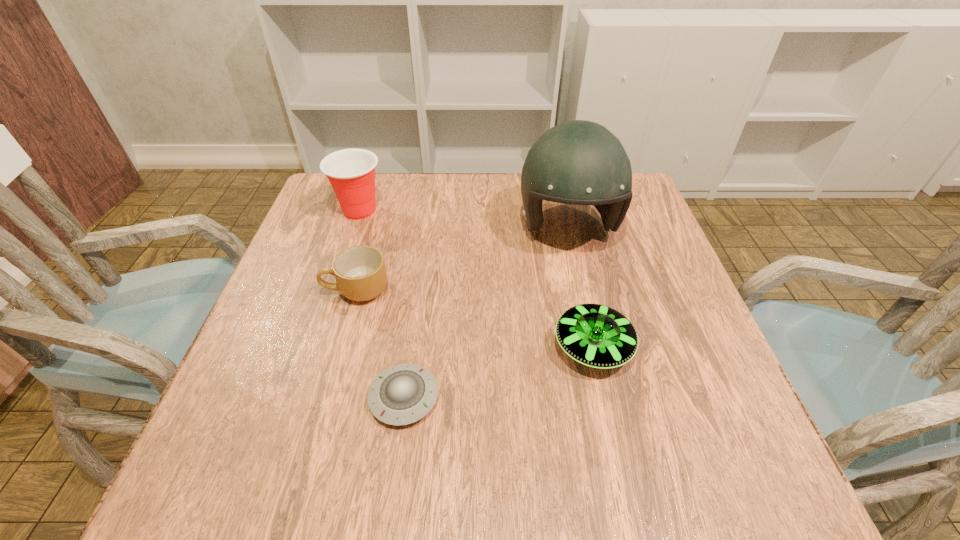
In the image, there is a desktop. At what (x,y) coordinates should I click in order to perform the action: click on vacant space at the near edge. Please return your answer as a coordinate pair (x, y). The width and height of the screenshot is (960, 540). Looking at the image, I should click on (597, 470).

I want to click on free point at the left edge, so click(x=328, y=299).

Locate an element on the screen. This screenshot has width=960, height=540. vacant space at the right edge of the desktop is located at coordinates 641,302.

Locate an element on the screen. This screenshot has height=540, width=960. free space between the mug and the taller saucer is located at coordinates (475, 318).

Find the location of a particular element. This screenshot has width=960, height=540. free space that is in between the shortest object and the second tallest object is located at coordinates (382, 304).

This screenshot has width=960, height=540. Find the location of `vacant area between the right saucer and the third farthest object`. vacant area between the right saucer and the third farthest object is located at coordinates (475, 318).

Find the location of `vacant space that is in between the football helmet and the right saucer`. vacant space that is in between the football helmet and the right saucer is located at coordinates (580, 287).

Where is `vacant point located between the mug and the right saucer`? vacant point located between the mug and the right saucer is located at coordinates (475, 318).

Where is `blank region between the tallest object and the left saucer`? This screenshot has height=540, width=960. blank region between the tallest object and the left saucer is located at coordinates (486, 313).

Where is `empty space that is in between the third nearest object and the left saucer`? empty space that is in between the third nearest object and the left saucer is located at coordinates (380, 343).